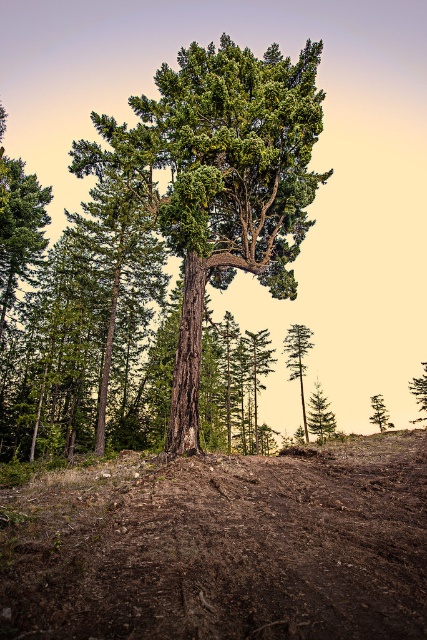
Which is more to the left, green matte tree at lower right or green rough bark tree at right?

green matte tree at lower right is more to the left.

Measure the distance between green matte tree at lower right and camera.

green matte tree at lower right is 126.49 feet away from camera.

The height and width of the screenshot is (640, 427). Describe the element at coordinates (319, 413) in the screenshot. I see `green matte tree at lower right` at that location.

Locate an element on the screen. This screenshot has height=640, width=427. green matte tree at lower right is located at coordinates (319, 413).

Which of these two, green rough bark tree at right or green matte tree at upper center, stands shorter?

green matte tree at upper center is shorter.

Does green rough bark tree at right appear on the left side of green matte tree at upper center?

In fact, green rough bark tree at right is to the right of green matte tree at upper center.

Is point (424, 380) less distant than point (385, 426)?

Yes.

At what (x,y) coordinates should I click in order to perform the action: click on green rough bark tree at right. Please return your answer as a coordinate pair (x, y). Looking at the image, I should click on (420, 388).

Which is in front, point (327, 433) or point (380, 424)?

Point (380, 424) is in front.

Does green matte tree at lower right lie in front of green matte tree at upper center?

No.

What do you see at coordinates (319, 413) in the screenshot?
I see `green matte tree at lower right` at bounding box center [319, 413].

Where is `green matte tree at lower right`? green matte tree at lower right is located at coordinates (319, 413).